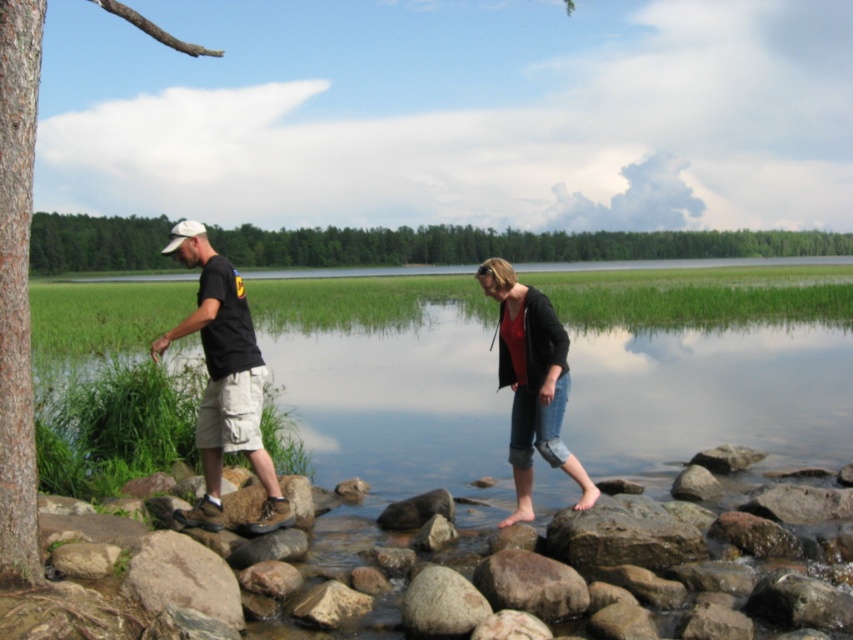
Who is lower down, black cotton t-shirt at left or smooth gray rock at lower center?

Positioned lower is smooth gray rock at lower center.

Does black cotton t-shirt at left have a greater width compared to smooth gray rock at lower center?

Yes.

Identify the location of black cotton t-shirt at left. (223, 381).

Who is positioned more to the right, green leafy tree at upper center or denim jeans at center?

green leafy tree at upper center is more to the right.

Describe the element at coordinates (503, 244) in the screenshot. I see `green leafy tree at upper center` at that location.

This screenshot has height=640, width=853. I want to click on green leafy tree at upper center, so click(503, 244).

Who is positioned more to the left, green leafy tree at upper center or smooth gray rock at lower center?

From the viewer's perspective, smooth gray rock at lower center appears more on the left side.

Does green leafy tree at upper center have a lesser height compared to smooth gray rock at lower center?

In fact, green leafy tree at upper center may be taller than smooth gray rock at lower center.

Who is more forward, (735, 243) or (432, 634)?

Positioned in front is point (432, 634).

In order to click on green leafy tree at upper center in this screenshot , I will do `click(503, 244)`.